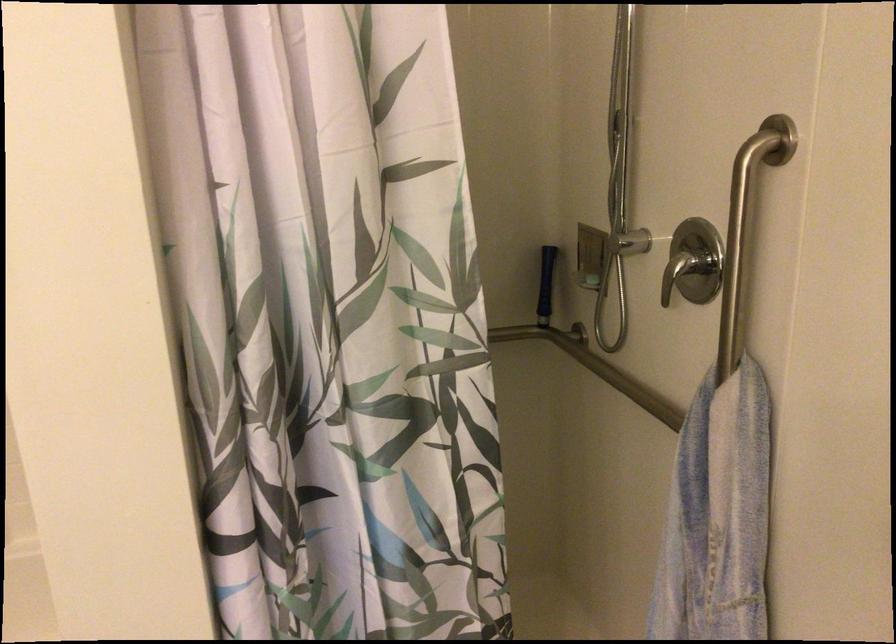
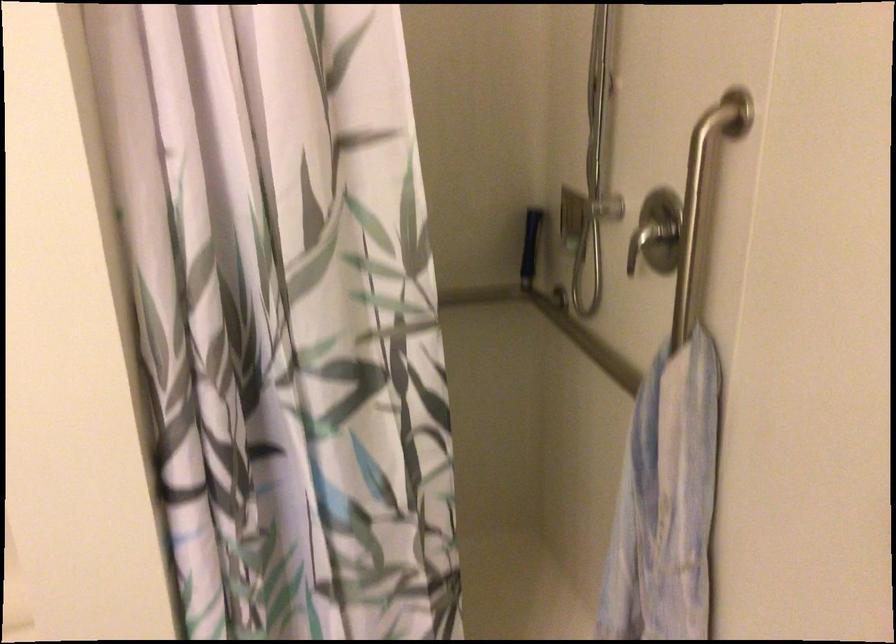
Locate, in the second image, the point that corresponds to the point at 616,371 in the first image.

(586, 341)